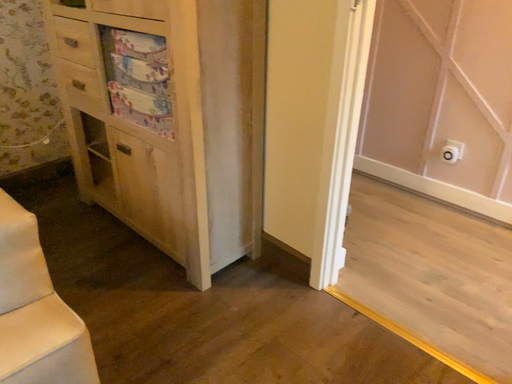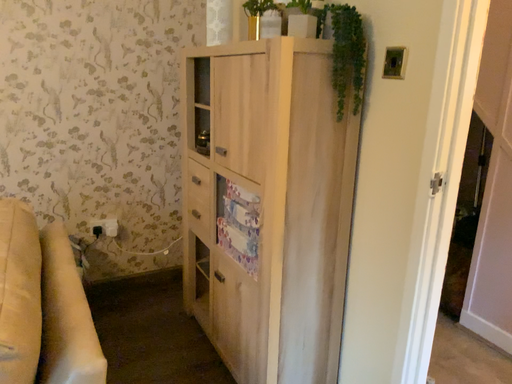
Question: Which way did the camera rotate in the video?

Choices:
 (A) rotated downward
 (B) rotated upward

Answer: (B)